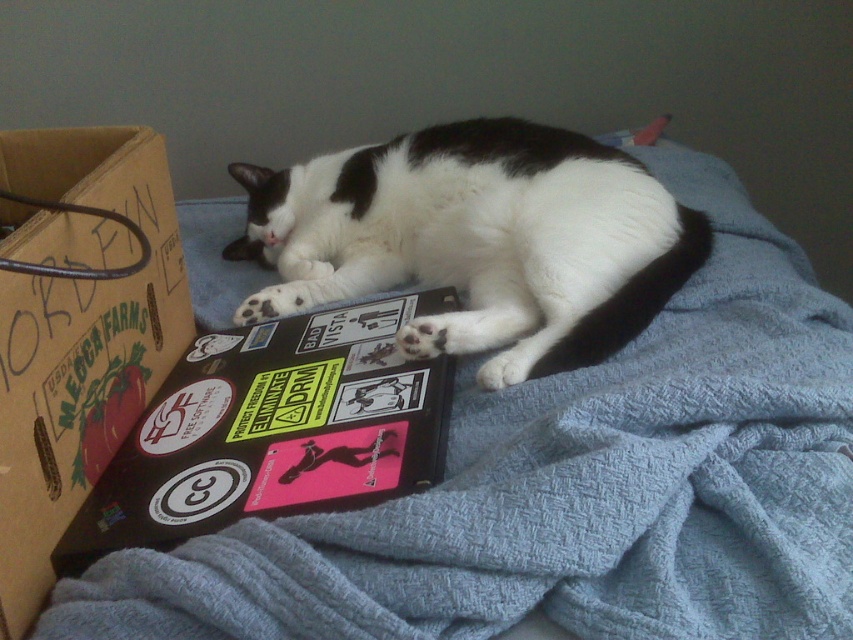
Between point (479, 196) and point (180, 426), which one is positioned in front?

Point (180, 426) is in front.

Describe the element at coordinates (477, 241) in the screenshot. Image resolution: width=853 pixels, height=640 pixels. I see `black and white fur cat at center` at that location.

Between point (567, 256) and point (225, 481), which one is positioned in front?

Positioned in front is point (225, 481).

Locate an element on the screen. This screenshot has height=640, width=853. black and white fur cat at center is located at coordinates (477, 241).

Is black and white fur cat at center taller than cardboard box at left?

Incorrect, black and white fur cat at center's height is not larger of cardboard box at left's.

Between point (599, 340) and point (148, 316), which one is positioned behind?

The point (148, 316) is behind.

Locate an element on the screen. black and white fur cat at center is located at coordinates (477, 241).

Which is more to the left, cardboard box at left or sticker-covered paperback book at center?

cardboard box at left

Is point (16, 355) positioned in front of point (370, 356)?

Yes.

Identify the location of cardboard box at left. (76, 330).